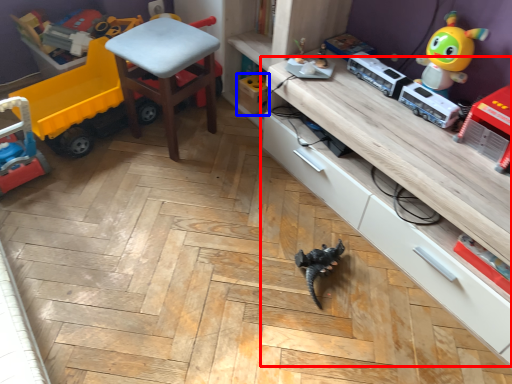
Question: Which of the following is the farthest to the observer, cabinetry (highlighted by a red box) or toy (highlighted by a blue box)?

Choices:
 (A) cabinetry
 (B) toy

Answer: (B)